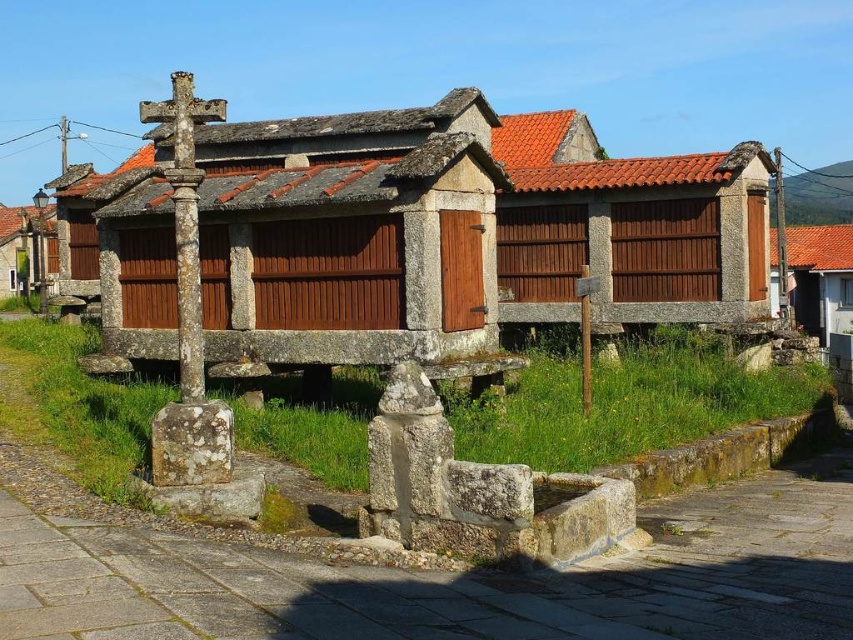
You are a visitor standing at the entrance of the brown wooden hut at left and want to see the brown wooden hut at center. Which direction should you walk to get a better view of it?

The brown wooden hut at center is shorter than the brown wooden hut at left, so you should walk forward away from the brown wooden hut at left to get a better view of the brown wooden hut at center.

You are standing in the rural area and want to take a photo of both the brown wooden hut at center and the brown wooden hut at left. Since you have a wide angle lens, can you capture both huts in the same frame without moving your position?

The brown wooden hut at center is in front of the brown wooden hut at left, so you can capture both in the same frame as the one in front will be visible alongside the one behind.